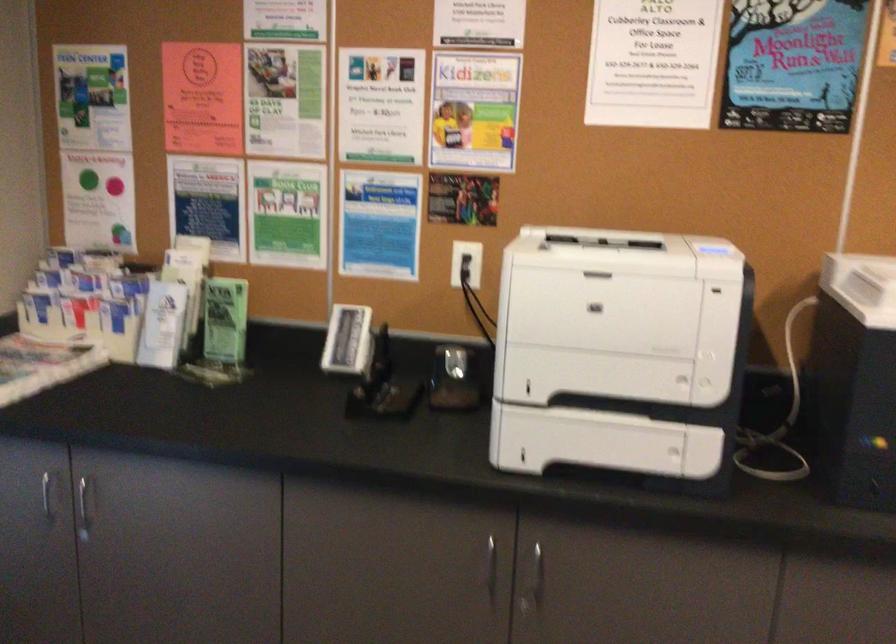
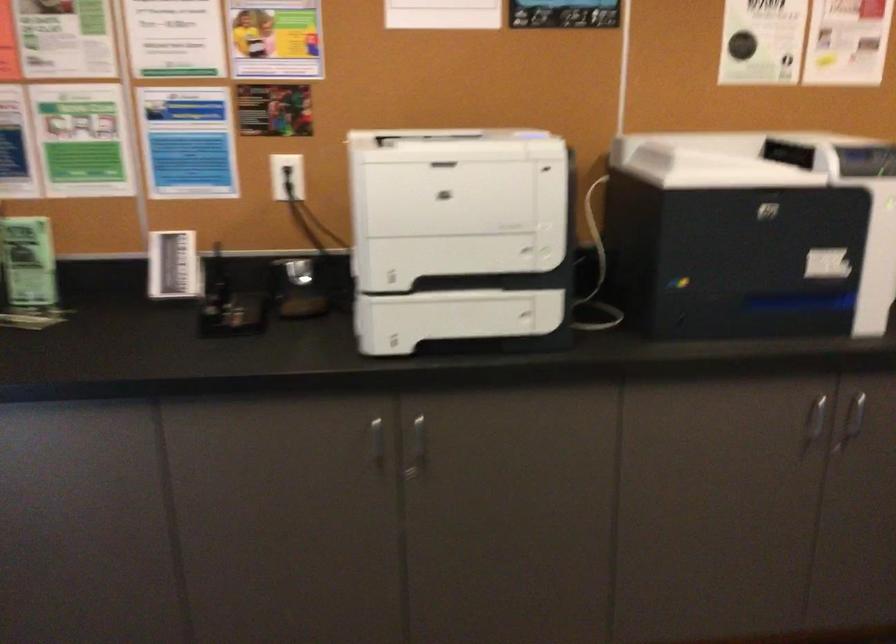
Where in the second image is the point corresponding to [490,562] from the first image?

(376, 442)